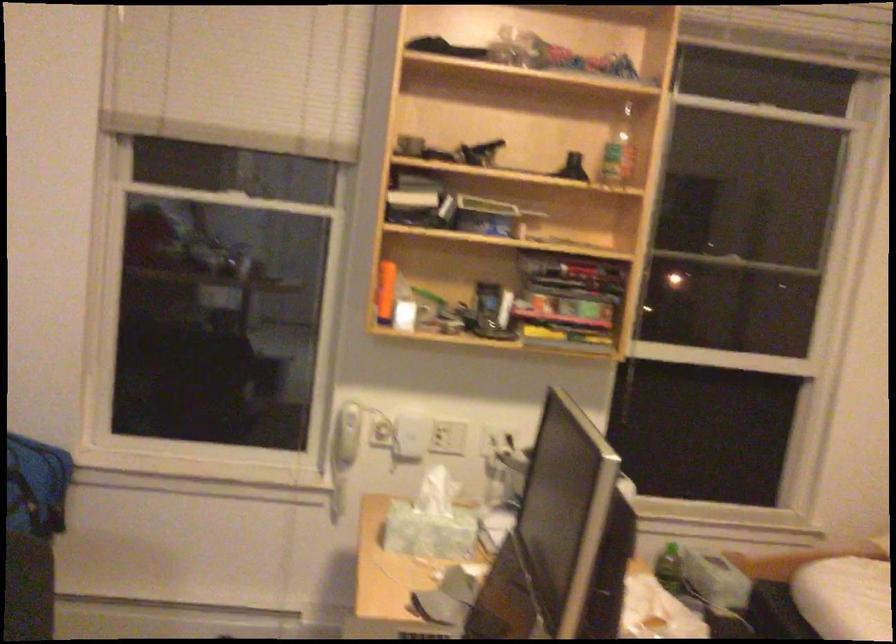
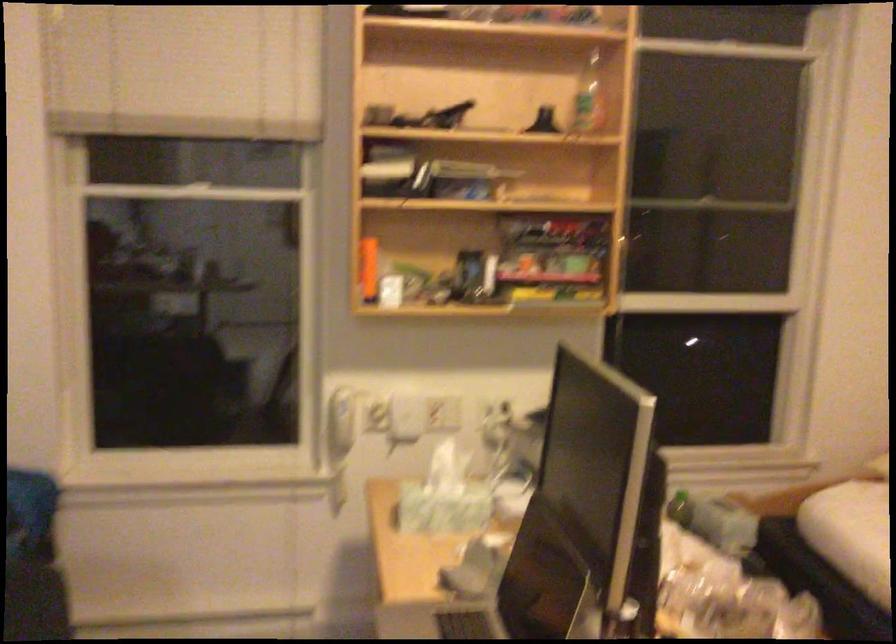
Question: Based on the continuous images, in which direction is the camera rotating? Reply with the corresponding letter.

Choices:
 (A) Left
 (B) Right
 (C) Up
 (D) Down

Answer: (B)